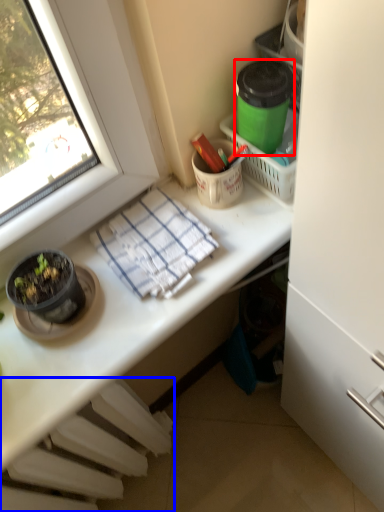
Question: Which object appears closest to the camera in this image, appliance (highlighted by a red box) or radiator (highlighted by a blue box)?

Choices:
 (A) appliance
 (B) radiator

Answer: (A)